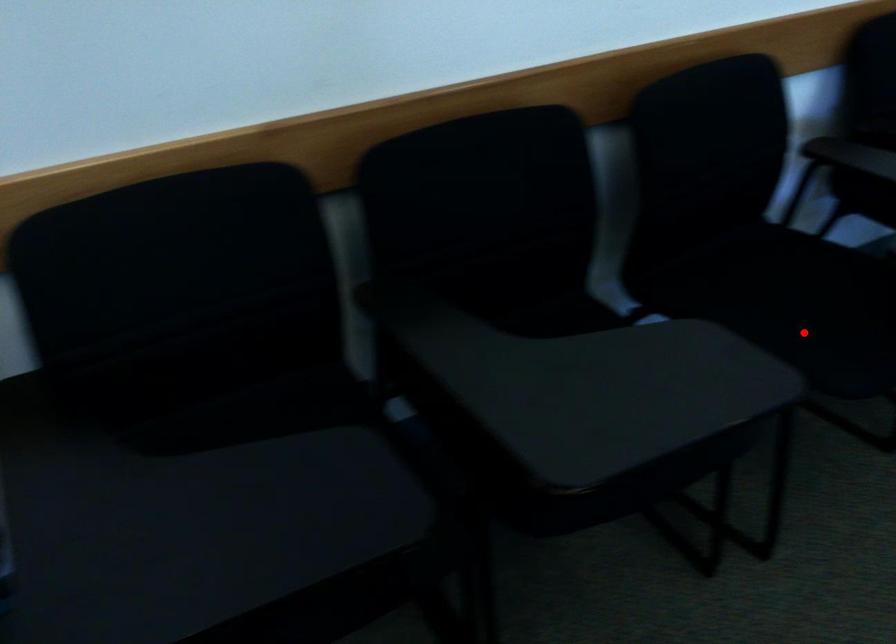
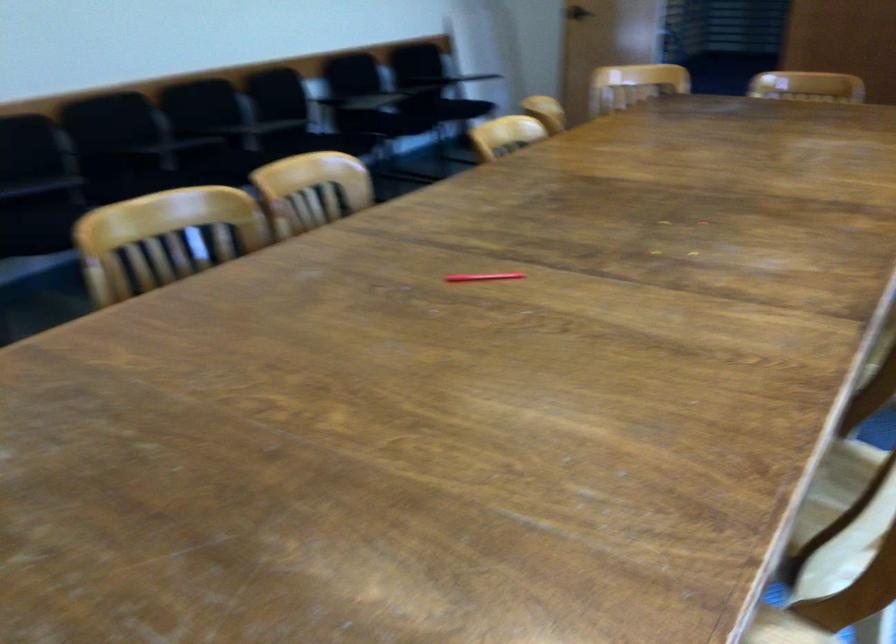
The point at the highlighted location is marked in the first image. Where is the corresponding point in the second image?

(306, 138)